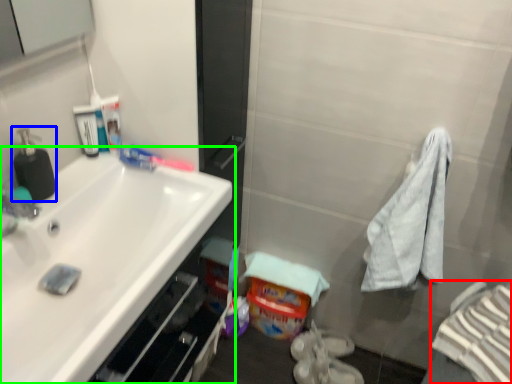
Question: Considering the real-world distances, which object is farthest from bath towel (highlighted by a red box)? soap dispenser (highlighted by a blue box) or sink (highlighted by a green box)?

Choices:
 (A) soap dispenser
 (B) sink

Answer: (A)